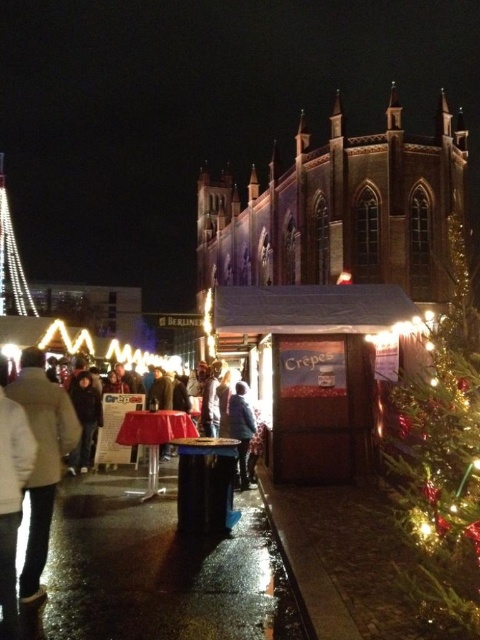
You are attending the Christmas market and notice a white matte jacket at lower left and a green shiny christmas tree at right. Which object is positioned lower in the image?

The white matte jacket at lower left is positioned below the green shiny christmas tree at right, so it is lower in the image.